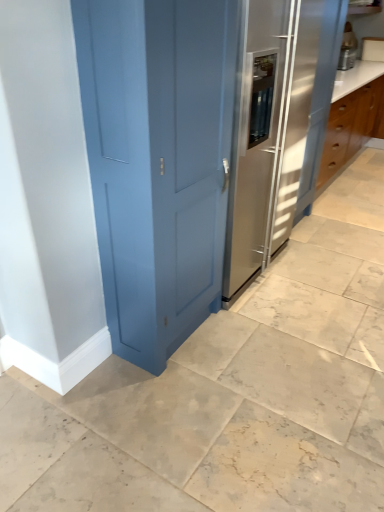
In order to face metallic silver appliance at upper right, should I rotate leftwards or rightwards?

You should rotate right by 20.266 degrees.

Identify the location of metallic silver appliance at upper right. (348, 48).

Describe the element at coordinates (348, 48) in the screenshot. Image resolution: width=384 pixels, height=512 pixels. I see `metallic silver appliance at upper right` at that location.

Where is `satin stainless steel fridge at center`? This screenshot has width=384, height=512. satin stainless steel fridge at center is located at coordinates (277, 127).

What do you see at coordinates (277, 127) in the screenshot?
I see `satin stainless steel fridge at center` at bounding box center [277, 127].

Locate an element on the screen. metallic silver appliance at upper right is located at coordinates (348, 48).

Which is more to the right, metallic silver appliance at upper right or satin stainless steel fridge at center?

Positioned to the right is metallic silver appliance at upper right.

Which is in front, metallic silver appliance at upper right or satin stainless steel fridge at center?

Positioned in front is satin stainless steel fridge at center.

Which is behind, point (345, 69) or point (267, 156)?

The point (345, 69) is farther from the camera.

From the image's perspective, which is below, metallic silver appliance at upper right or satin stainless steel fridge at center?

satin stainless steel fridge at center.

From a real-world perspective, is metallic silver appliance at upper right physically located above or below satin stainless steel fridge at center?

metallic silver appliance at upper right is situated higher than satin stainless steel fridge at center in the real world.

Which object is thinner, metallic silver appliance at upper right or satin stainless steel fridge at center?

metallic silver appliance at upper right.

Considering the sizes of objects metallic silver appliance at upper right and satin stainless steel fridge at center in the image provided, who is shorter, metallic silver appliance at upper right or satin stainless steel fridge at center?

Standing shorter between the two is metallic silver appliance at upper right.

Is metallic silver appliance at upper right bigger than satin stainless steel fridge at center?

No, metallic silver appliance at upper right is not bigger than satin stainless steel fridge at center.

Is metallic silver appliance at upper right located outside satin stainless steel fridge at center?

Yes, metallic silver appliance at upper right is located beyond the bounds of satin stainless steel fridge at center.

Is metallic silver appliance at upper right not near satin stainless steel fridge at center?

Yes, metallic silver appliance at upper right is far from satin stainless steel fridge at center.

Could you tell me if metallic silver appliance at upper right is facing satin stainless steel fridge at center?

No, metallic silver appliance at upper right is not turned towards satin stainless steel fridge at center.

How different are the orientations of metallic silver appliance at upper right and satin stainless steel fridge at center in degrees?

2.35 degrees.

At what (x,y) coordinates should I click in order to perform the action: click on appliance behind the satin stainless steel fridge at center. Please return your answer as a coordinate pair (x, y). The image size is (384, 512). Looking at the image, I should click on (348, 48).

Between satin stainless steel fridge at center and metallic silver appliance at upper right, which one appears on the right side from the viewer's perspective?

Answer: metallic silver appliance at upper right is more to the right.

Considering the positions of objects satin stainless steel fridge at center and metallic silver appliance at upper right in the image provided, who is in front, satin stainless steel fridge at center or metallic silver appliance at upper right?

satin stainless steel fridge at center is more forward.

Does point (293, 132) appear closer or farther from the camera than point (338, 63)?

Point (293, 132) appears to be closer to the viewer than point (338, 63).

From the image's perspective, is satin stainless steel fridge at center positioned above or below metallic silver appliance at upper right?

From the image's perspective, satin stainless steel fridge at center appears below metallic silver appliance at upper right.

From a real-world perspective, which object stands above the other?

metallic silver appliance at upper right is physically above.

Does satin stainless steel fridge at center have a lesser width compared to metallic silver appliance at upper right?

No, satin stainless steel fridge at center is not thinner than metallic silver appliance at upper right.

Between satin stainless steel fridge at center and metallic silver appliance at upper right, which one has less height?

With less height is metallic silver appliance at upper right.

Considering the relative sizes of satin stainless steel fridge at center and metallic silver appliance at upper right in the image provided, is satin stainless steel fridge at center smaller than metallic silver appliance at upper right?

No, satin stainless steel fridge at center is not smaller than metallic silver appliance at upper right.

Is satin stainless steel fridge at center outside of metallic silver appliance at upper right?

Yes, satin stainless steel fridge at center is outside of metallic silver appliance at upper right.

Is satin stainless steel fridge at center next to metallic silver appliance at upper right and touching it?

No, satin stainless steel fridge at center is not touching metallic silver appliance at upper right.

Based on the photo, is satin stainless steel fridge at center oriented towards metallic silver appliance at upper right?

No, satin stainless steel fridge at center is not facing towards metallic silver appliance at upper right.

How different are the orientations of satin stainless steel fridge at center and metallic silver appliance at upper right in degrees?

2.35 degrees separate the facing orientations of satin stainless steel fridge at center and metallic silver appliance at upper right.

Find the location of a particular element. appliance behind the satin stainless steel fridge at center is located at coordinates (348, 48).

I want to click on appliance behind the satin stainless steel fridge at center, so click(348, 48).

At what (x,y) coordinates should I click in order to perform the action: click on fridge lying in front of the metallic silver appliance at upper right. Please return your answer as a coordinate pair (x, y). Looking at the image, I should click on (277, 127).